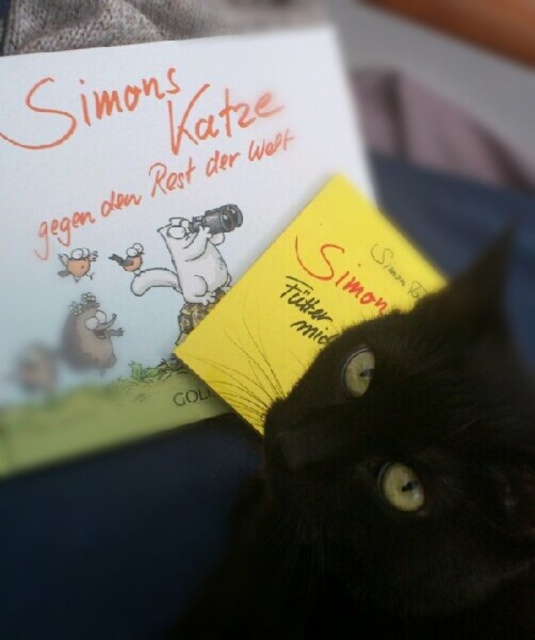
Question: Which of the following is the closest to the observer?

Choices:
 (A) (406, 616)
 (B) (110, 193)
 (C) (196, 333)
 (D) (26, 188)

Answer: (A)

Question: Estimate the real-world distances between objects in this image. Which object is farther from the black fur cat at center?

Choices:
 (A) yellow paper at center
 (B) orange handwritten text at upper left

Answer: (B)

Question: Is the position of black fur cat at center less distant than that of orange handwritten text at upper left?

Choices:
 (A) no
 (B) yes

Answer: (B)

Question: Can you confirm if black fur cat at center is positioned to the right of orange handwritten text at upper left?

Choices:
 (A) no
 (B) yes

Answer: (B)

Question: Among these points, which one is nearest to the camera?

Choices:
 (A) (159, 170)
 (B) (337, 632)
 (C) (295, 276)

Answer: (B)

Question: Does yellow paper card at upper center have a greater width compared to orange handwritten text at upper left?

Choices:
 (A) no
 (B) yes

Answer: (B)